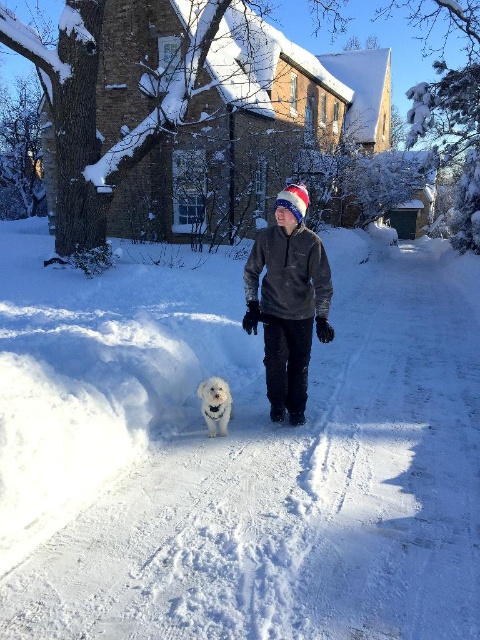
Question: Which point is farther from the camera taking this photo?

Choices:
 (A) (227, 419)
 (B) (279, 291)

Answer: (A)

Question: Does dark gray fleece at center appear on the left side of white fluffy dog at center?

Choices:
 (A) yes
 (B) no

Answer: (B)

Question: Does dark gray fleece at center have a greater width compared to white fluffy dog at center?

Choices:
 (A) no
 (B) yes

Answer: (B)

Question: Which object appears closest to the camera in this image?

Choices:
 (A) white fluffy dog at center
 (B) dark gray fleece at center

Answer: (B)

Question: Can you confirm if dark gray fleece at center is positioned below white fluffy dog at center?

Choices:
 (A) yes
 (B) no

Answer: (B)

Question: Which point is closer to the camera taking this photo?

Choices:
 (A) (213, 433)
 (B) (264, 301)

Answer: (A)